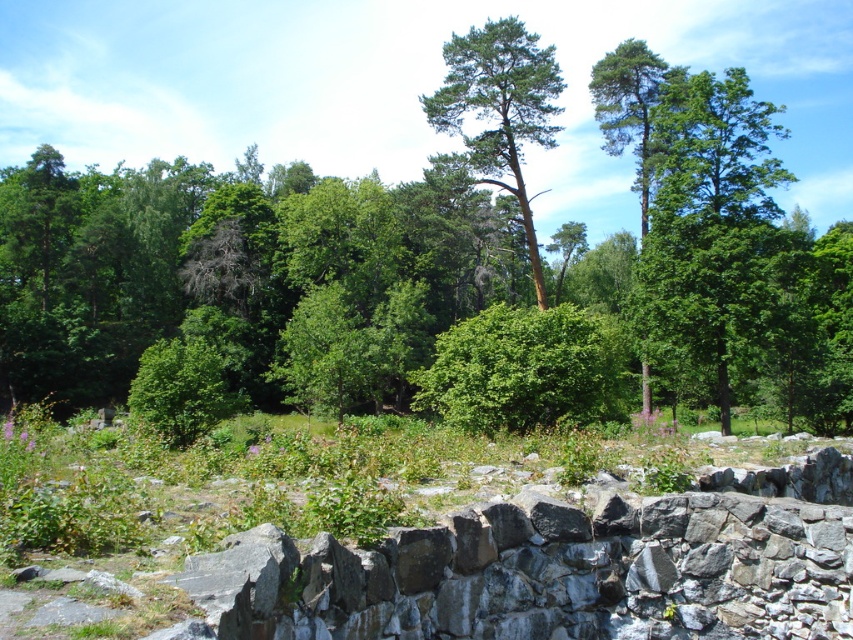
Question: In this image, where is green leafy forest at center located relative to green rough bark tree at center?

Choices:
 (A) left
 (B) right

Answer: (B)

Question: Is green leafy forest at center closer to the viewer compared to green matte tree at upper right?

Choices:
 (A) no
 (B) yes

Answer: (B)

Question: Among these objects, which one is nearest to the camera?

Choices:
 (A) green leafy forest at center
 (B) green leafy tree at upper right
 (C) green rough bark tree at center
 (D) green matte tree at upper right

Answer: (A)

Question: Does green leafy forest at center appear under green leafy tree at upper right?

Choices:
 (A) no
 (B) yes

Answer: (A)

Question: Among these objects, which one is farthest from the camera?

Choices:
 (A) green leafy forest at center
 (B) green rough bark tree at center
 (C) green leafy tree at upper right
 (D) green matte tree at upper right

Answer: (B)

Question: Which object is farther from the camera taking this photo?

Choices:
 (A) green leafy forest at center
 (B) green leafy tree at upper right

Answer: (B)